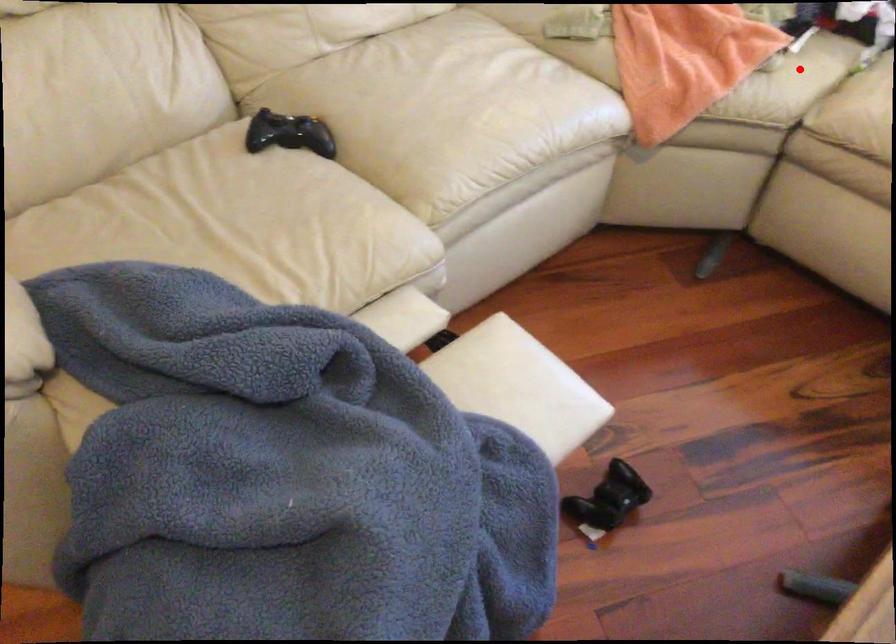
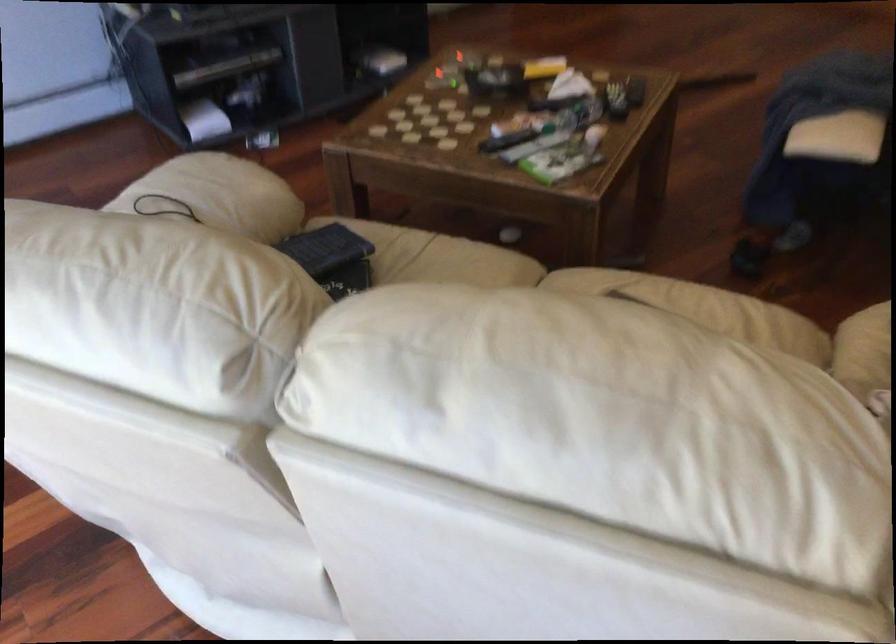
The point at the highlighted location is marked in the first image. Where is the corresponding point in the second image?

(864, 351)